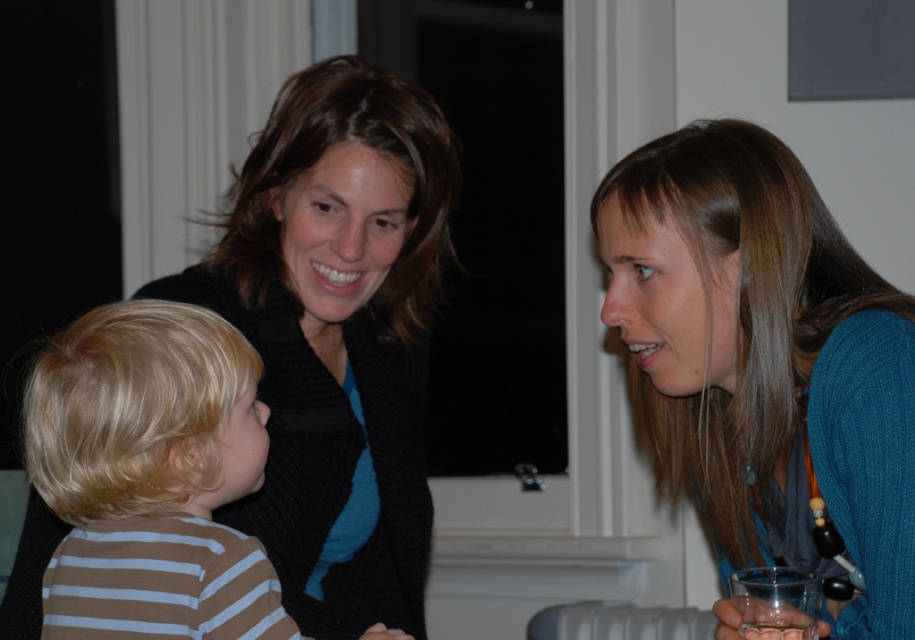
Between blue knitted sweater at right and transparent plastic glass at lower right, which one is positioned lower?

transparent plastic glass at lower right is below.

Does blue knitted sweater at right appear on the right side of transparent plastic glass at lower right?

No, blue knitted sweater at right is not to the right of transparent plastic glass at lower right.

Does point (770, 493) come farther from viewer compared to point (799, 630)?

Yes, point (770, 493) is behind point (799, 630).

Where is `blue knitted sweater at right`? blue knitted sweater at right is located at coordinates [x=763, y=358].

The width and height of the screenshot is (915, 640). What do you see at coordinates (763, 358) in the screenshot?
I see `blue knitted sweater at right` at bounding box center [763, 358].

Who is taller, blue knitted sweater at right or brown striped shirt at lower left?

With more height is blue knitted sweater at right.

The image size is (915, 640). What do you see at coordinates (763, 358) in the screenshot?
I see `blue knitted sweater at right` at bounding box center [763, 358].

Find the location of `blue knitted sweater at right`. blue knitted sweater at right is located at coordinates (763, 358).

Identify the location of brown striped shirt at lower left. (151, 476).

Which of these two, brown striped shirt at lower left or transparent plastic glass at lower right, stands taller?

brown striped shirt at lower left is taller.

Image resolution: width=915 pixels, height=640 pixels. In order to click on brown striped shirt at lower left in this screenshot , I will do `click(151, 476)`.